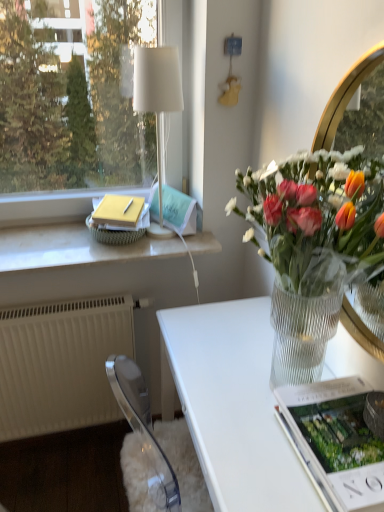
What are the coordinates of `blank area to the left of clear glass vase at right` in the screenshot? It's located at pos(201,373).